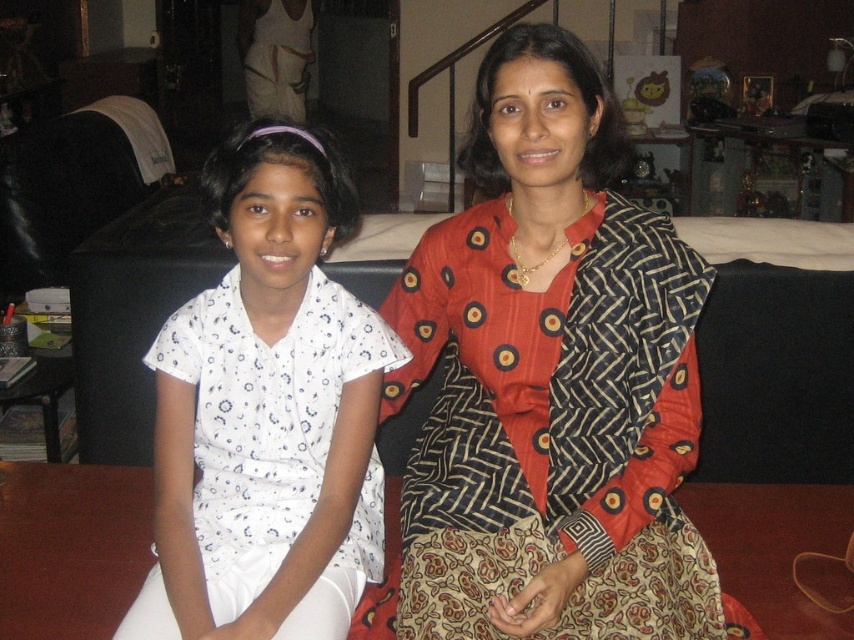
Please provide the 2D coordinates of the red printed sari at center in the image coordinate system where the origin is at the bottom left corner of the image.

The 2D coordinates of the red printed sari at center are at point (550, 380).

You are a photographer setting up a shoot in this living room. You need to ensure that both the white printed blouse at left and the red printed sari at center are visible in your shot. Based on their positions, which clothing item might partially obscure the other?

The white printed blouse at left is behind the red printed sari at center, so the red printed sari at center may partially obscure the white printed blouse at left.